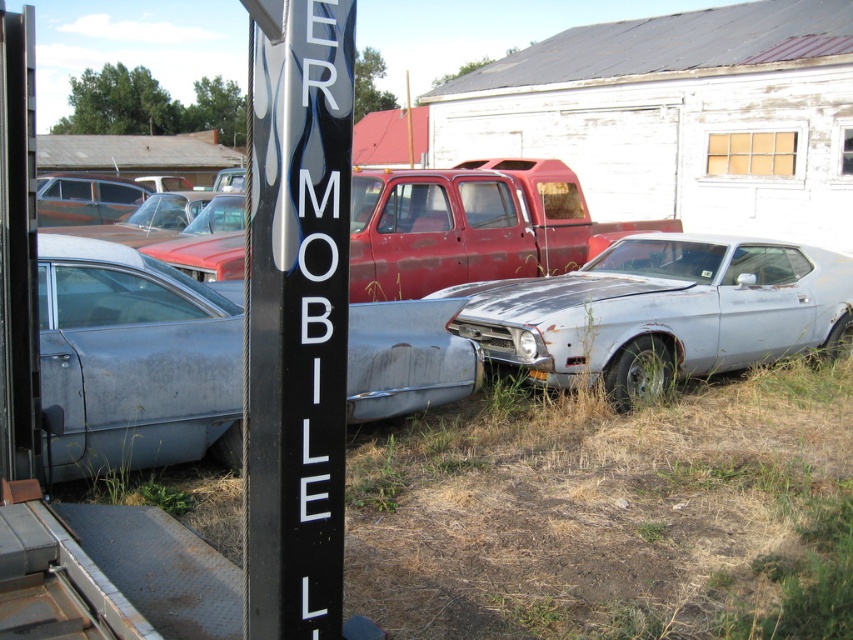
Question: Is black plastic sign at center bigger than rusty metallic car at center?

Choices:
 (A) no
 (B) yes

Answer: (A)

Question: Does rusty metal car at center have a lesser width compared to rusty metal pickup truck at center?

Choices:
 (A) no
 (B) yes

Answer: (B)

Question: Does black plastic sign at center lie behind rusty metal car at left?

Choices:
 (A) no
 (B) yes

Answer: (A)

Question: Estimate the real-world distances between objects in this image. Which object is closer to the rusty metal pickup truck at center?

Choices:
 (A) rusty metal car at left
 (B) black plastic sign at center

Answer: (A)

Question: Which object appears farthest from the camera in this image?

Choices:
 (A) rusty metal pickup truck at center
 (B) rusty metal car at left
 (C) rusty metal car at center

Answer: (B)

Question: Estimate the real-world distances between objects in this image. Which object is farther from the rusty metal car at left?

Choices:
 (A) rusty metallic car at center
 (B) rusty metal pickup truck at center
 (C) black plastic sign at center
 (D) rusty metal car at center

Answer: (C)